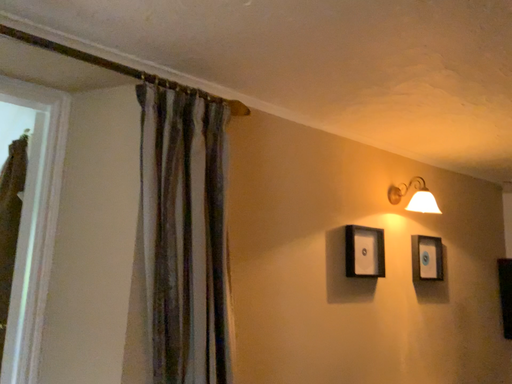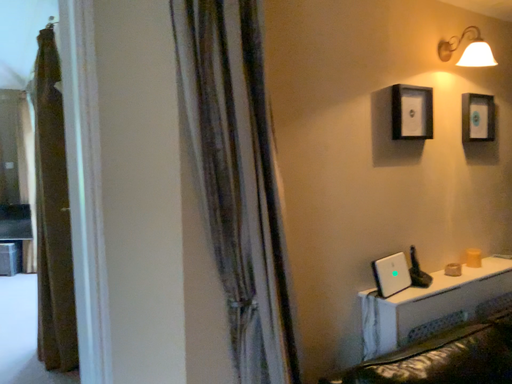
Question: How did the camera likely rotate when shooting the video?

Choices:
 (A) rotated upward
 (B) rotated downward

Answer: (B)